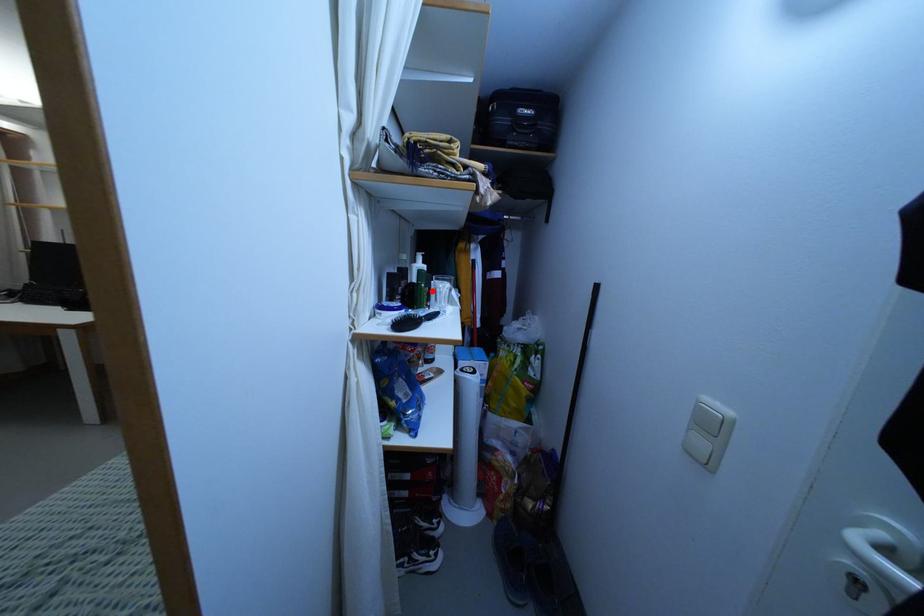
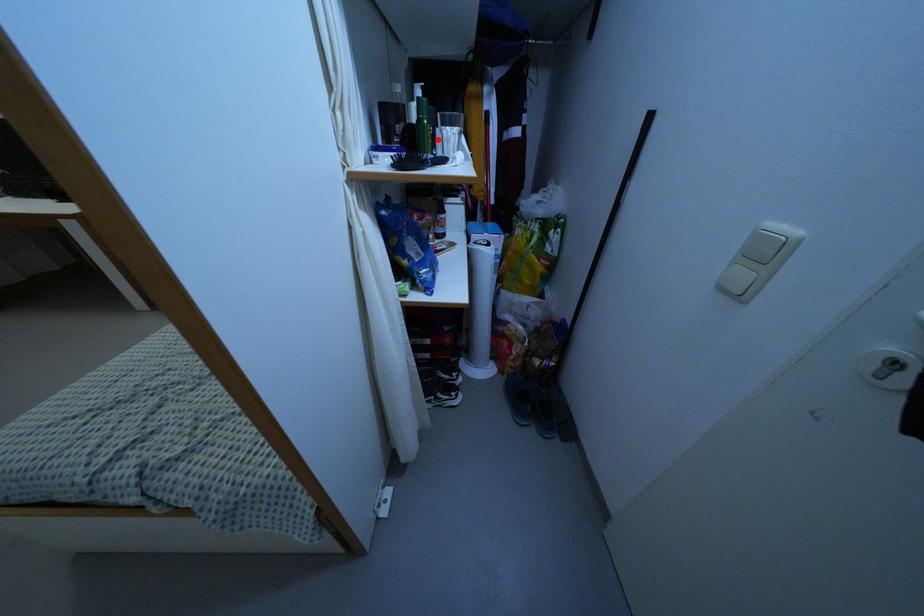
I am providing you with two images of the same scene from different viewpoints. A red point is marked on the first image and another point is marked on the second image. Do the highlighted points in image1 and image2 indicate the same real-world spot?

Yes